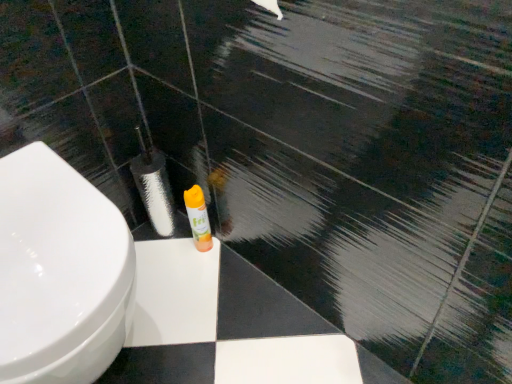
Question: Would you consider white glossy toilet at lower left to be distant from orange matte spray can at center?

Choices:
 (A) yes
 (B) no

Answer: (B)

Question: Is white glossy toilet at lower left bigger than orange matte spray can at center?

Choices:
 (A) yes
 (B) no

Answer: (A)

Question: Is white glossy toilet at lower left positioned with its back to orange matte spray can at center?

Choices:
 (A) no
 (B) yes

Answer: (A)

Question: Does white glossy toilet at lower left have a greater height compared to orange matte spray can at center?

Choices:
 (A) no
 (B) yes

Answer: (B)

Question: From a real-world perspective, is white glossy toilet at lower left below orange matte spray can at center?

Choices:
 (A) yes
 (B) no

Answer: (B)

Question: Is white glossy toilet at lower left thinner than orange matte spray can at center?

Choices:
 (A) yes
 (B) no

Answer: (B)

Question: Is orange matte spray can at center to the right of white glossy toilet at lower left from the viewer's perspective?

Choices:
 (A) yes
 (B) no

Answer: (A)

Question: Can you confirm if orange matte spray can at center is thinner than white glossy toilet at lower left?

Choices:
 (A) no
 (B) yes

Answer: (B)

Question: From a real-world perspective, is orange matte spray can at center physically above white glossy toilet at lower left?

Choices:
 (A) no
 (B) yes

Answer: (A)

Question: From the image's perspective, is orange matte spray can at center under white glossy toilet at lower left?

Choices:
 (A) yes
 (B) no

Answer: (B)

Question: Does orange matte spray can at center appear on the left side of white glossy toilet at lower left?

Choices:
 (A) yes
 (B) no

Answer: (B)

Question: Is orange matte spray can at center taller than white glossy toilet at lower left?

Choices:
 (A) yes
 (B) no

Answer: (B)

Question: In terms of size, does orange matte spray can at center appear bigger or smaller than white glossy toilet at lower left?

Choices:
 (A) small
 (B) big

Answer: (A)